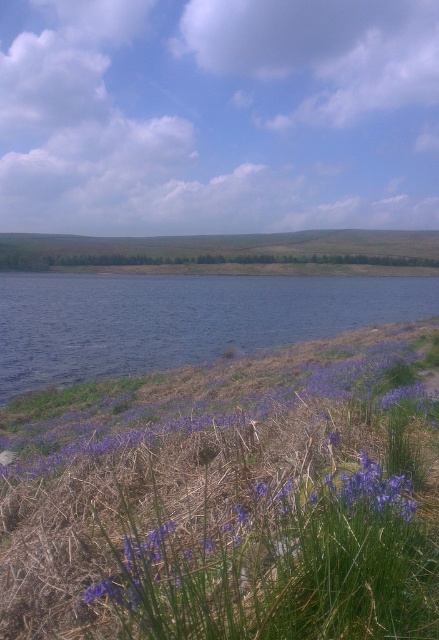
Question: Does purple grass at lower center have a smaller size compared to blue liquid water at lower left?

Choices:
 (A) no
 (B) yes

Answer: (B)

Question: Which of the following is the closest to the observer?

Choices:
 (A) purple grass at lower center
 (B) purple matte flower at lower left
 (C) blue liquid water at lower left

Answer: (A)

Question: Which point appears closest to the camera in this image?

Choices:
 (A) (43, 468)
 (B) (177, 339)

Answer: (A)

Question: Does purple grass at lower center have a lesser width compared to purple matte flower at lower left?

Choices:
 (A) no
 (B) yes

Answer: (B)

Question: Can you confirm if purple grass at lower center is positioned to the left of blue liquid water at lower left?

Choices:
 (A) yes
 (B) no

Answer: (B)

Question: Which object appears closest to the camera in this image?

Choices:
 (A) purple grass at lower center
 (B) blue liquid water at lower left

Answer: (A)